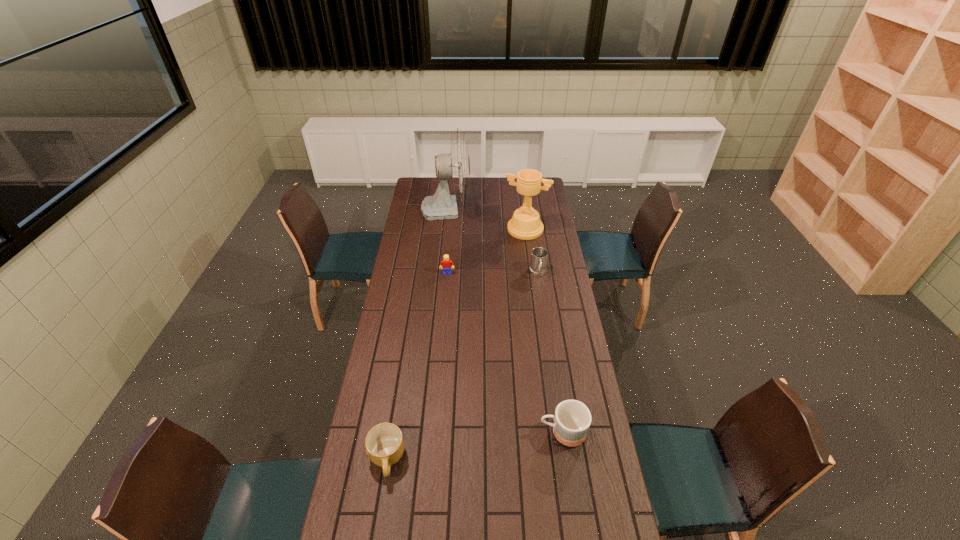
You are a GUI agent. You are given a task and a screenshot of the screen. Output one action in this format:
    pyautogui.click(x=<x>, y=<y>)
    Task: Click on the vacant space located 0.140m on the side with the handle of the shortest object
    This screenshot has height=540, width=960.
    Given the screenshot: What is the action you would take?
    pyautogui.click(x=375, y=531)

The height and width of the screenshot is (540, 960). I want to click on object that is at the far edge, so click(x=456, y=165).

Find the location of `fan that is at the left edge`. fan that is at the left edge is located at coordinates (456, 165).

Find the location of `mug present at the left edge`. mug present at the left edge is located at coordinates (x=384, y=443).

I want to click on award located in the right edge section of the desktop, so click(525, 224).

Image resolution: width=960 pixels, height=540 pixels. Find the location of `object that is at the far left corner`. object that is at the far left corner is located at coordinates click(456, 165).

Identify the location of vacant space at the left edge. The width and height of the screenshot is (960, 540). (380, 488).

Locate an element on the screen. vacant space at the right edge of the desktop is located at coordinates (559, 289).

In order to click on free space between the fifth shortest object and the shortest object in this screenshot , I will do `click(456, 344)`.

Image resolution: width=960 pixels, height=540 pixels. What are the coordinates of `free space between the shortest object and the fan` in the screenshot? It's located at (417, 333).